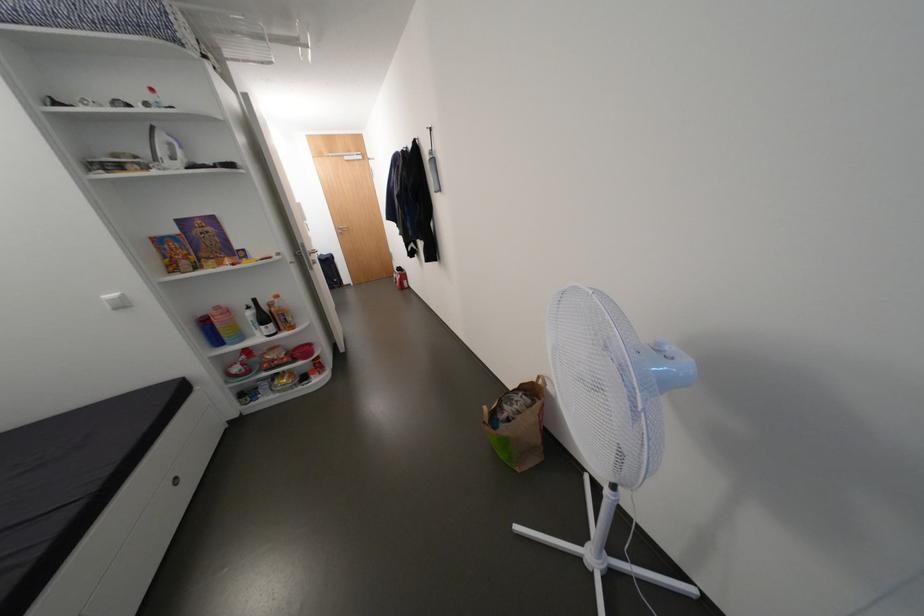
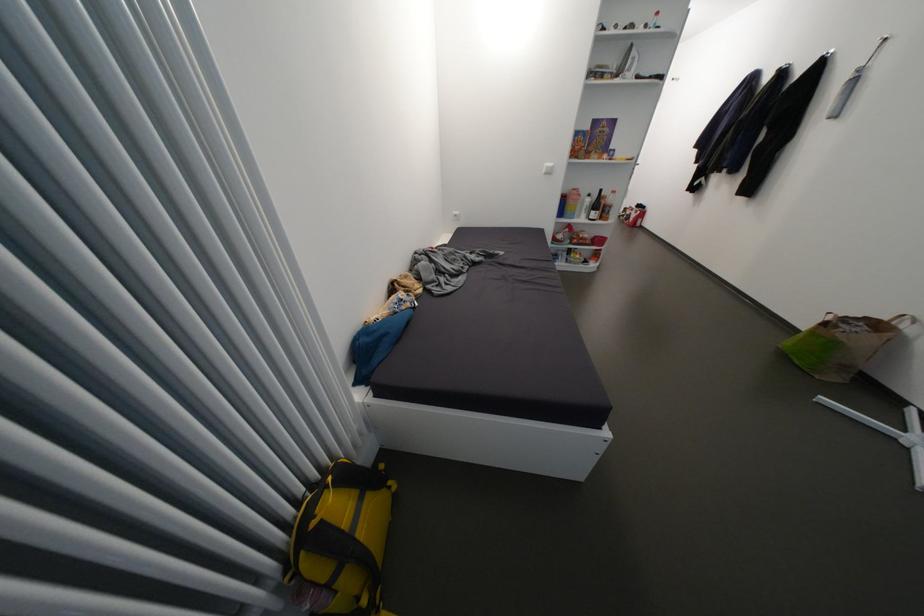
In the second image, find the point that corresponds to (x=258, y=315) in the first image.

(596, 201)